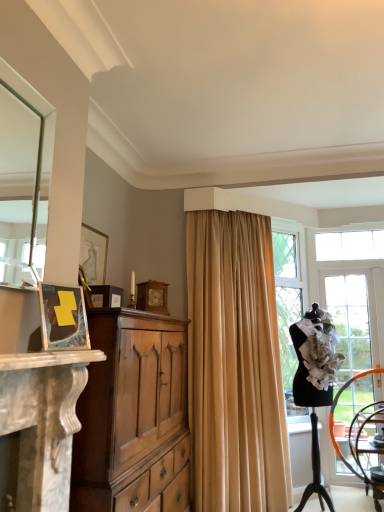
Question: Does point (342, 309) appear closer or farther from the camera than point (67, 338)?

Choices:
 (A) farther
 (B) closer

Answer: (A)

Question: Looking at the image, does black mannequin at right seem bigger or smaller compared to matte black picture frame at left, the 4th picture frame from the back?

Choices:
 (A) big
 (B) small

Answer: (A)

Question: Considering the real-world distances, which object is closest to the clear glass door at right?

Choices:
 (A) beige fabric curtain at center
 (B) wooden chair at lower right
 (C) matte gold picture frame at upper left, arranged as the 3th picture frame when viewed from the front
 (D) black mannequin at right
 (E) matte brown picture frame at center-left, the 2th picture frame from the front

Answer: (D)

Question: Based on their relative distances, which object is nearer to the matte brown picture frame at center-left, the 2th picture frame from the front?

Choices:
 (A) matte black picture frame at left, the 4th picture frame from the back
 (B) clear glass door at right
 (C) beige fabric curtain at center
 (D) wooden chair at lower right
 (E) matte gold picture frame at upper left, arranged as the 3th picture frame when viewed from the front

Answer: (A)